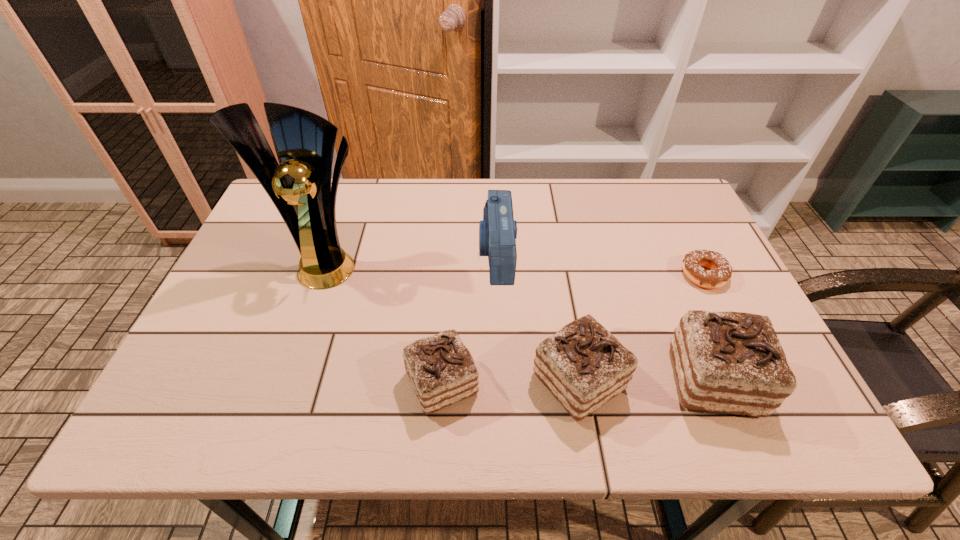
Locate an element on the screen. Image resolution: width=960 pixels, height=540 pixels. vacant space that's between the rightmost chocolate cake and the award is located at coordinates (521, 321).

Where is `blank region between the camera and the leftmost chocolate cake`? This screenshot has height=540, width=960. blank region between the camera and the leftmost chocolate cake is located at coordinates (469, 318).

The image size is (960, 540). I want to click on vacant space in between the second shortest chocolate cake and the rightmost chocolate cake, so click(x=646, y=381).

Locate an element on the screen. The width and height of the screenshot is (960, 540). free space between the rightmost chocolate cake and the camera is located at coordinates (605, 317).

What are the coordinates of `object that is the second closest to the camera` in the screenshot? It's located at (441, 370).

Locate an element on the screen. The height and width of the screenshot is (540, 960). the fourth closest object to the award is located at coordinates (733, 362).

Select which chocolate cake is the closest to the shortest chocolate cake. Please provide its 2D coordinates. Your answer should be formatted as a tuple, i.e. [(x, y)], where the tuple contains the x and y coordinates of a point satisfying the conditions above.

[(583, 365)]

You are a GUI agent. You are given a task and a screenshot of the screen. Output one action in this format:
    pyautogui.click(x=<x>, y=<y>)
    Task: Click on the second closest chocolate cake to the fifth tallest object
    The height and width of the screenshot is (540, 960).
    Given the screenshot: What is the action you would take?
    pyautogui.click(x=733, y=362)

Identify the location of free space that satisfies the following two spatial constraints: 1. on the lens of the camera; 2. at the front of the leftmost object, where the globe is visible. Image resolution: width=960 pixels, height=540 pixels. [496, 261].

This screenshot has width=960, height=540. In order to click on vacant position in the image that satisfies the following two spatial constraints: 1. on the back side of the shortest object; 2. on the lens of the camera in this screenshot , I will do `click(693, 254)`.